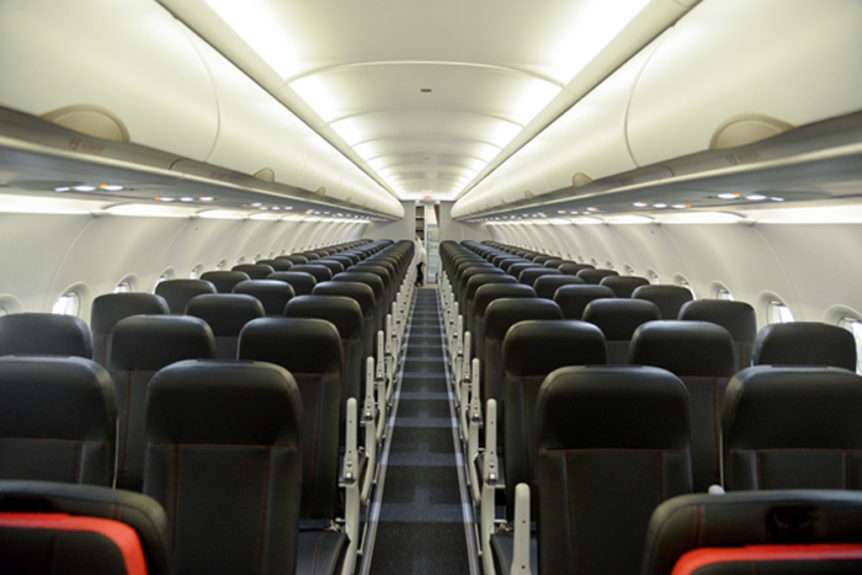
This screenshot has height=575, width=862. Find the location of `overhead bins`. overhead bins is located at coordinates (751, 80), (582, 137), (488, 187), (161, 91), (252, 105), (335, 183), (389, 196), (654, 115).